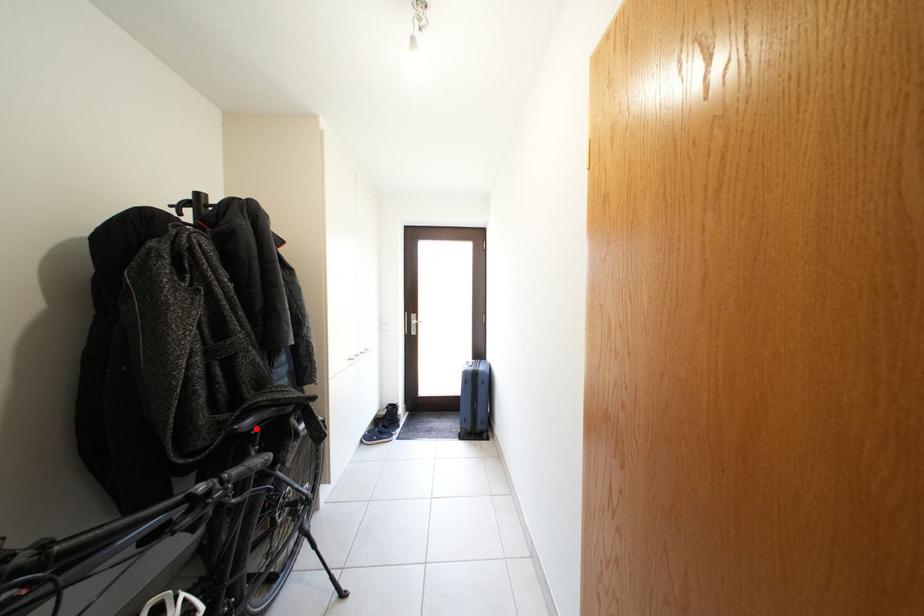
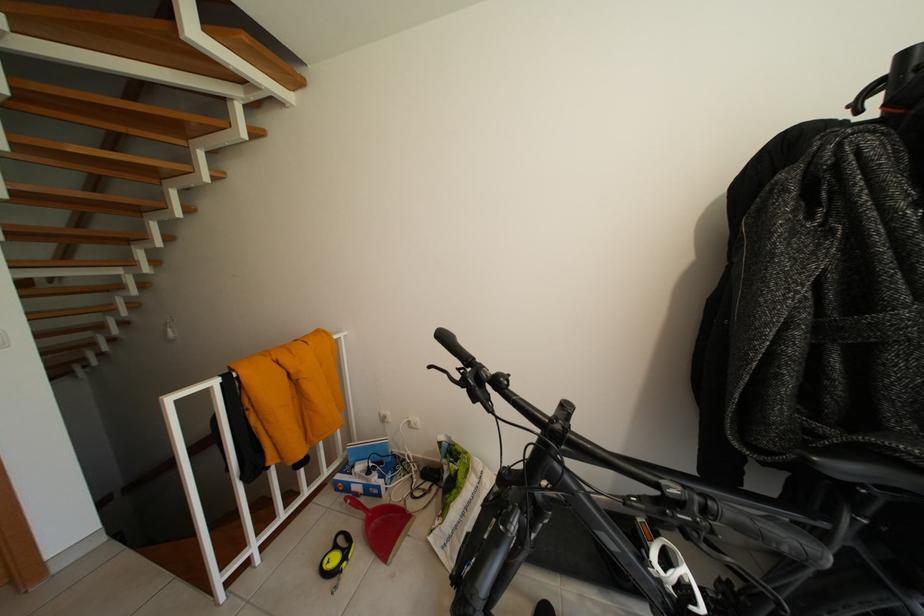
The point at the highlighted location is marked in the first image. Where is the corresponding point in the second image?

(852, 474)